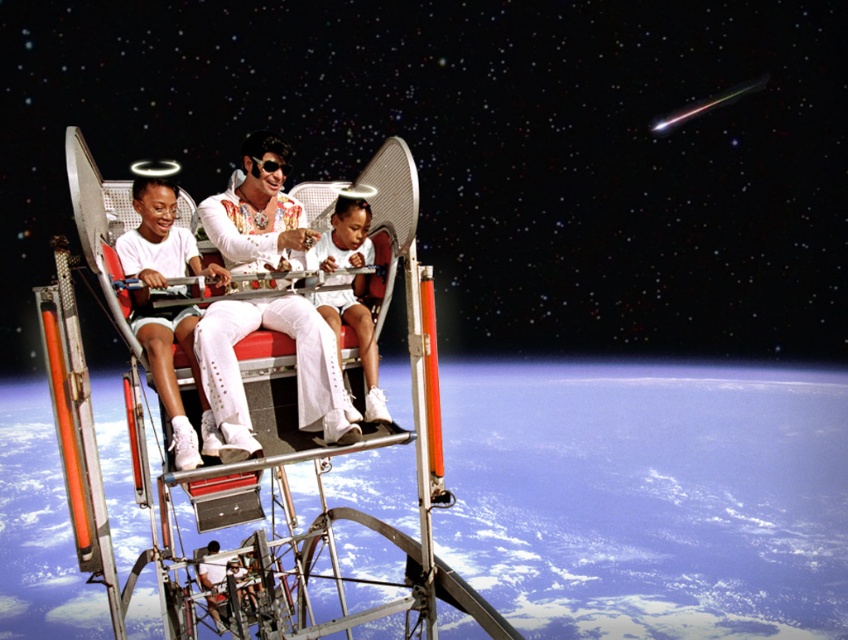
Question: Which of the following is the closest to the observer?

Choices:
 (A) white glossy shirt at center
 (B) white satin suit at center

Answer: (B)

Question: Which object is farther from the camera taking this photo?

Choices:
 (A) white satin suit at center
 (B) white glossy shirt at center
 (C) white matte shorts at left

Answer: (B)

Question: Does white satin suit at center have a smaller size compared to white glossy shirt at center?

Choices:
 (A) yes
 (B) no

Answer: (B)

Question: Can you confirm if white satin suit at center is wider than white matte shorts at left?

Choices:
 (A) yes
 (B) no

Answer: (A)

Question: Which point is closer to the camera?

Choices:
 (A) (283, 268)
 (B) (365, 243)

Answer: (A)

Question: Can you confirm if white matte shorts at left is wider than white glossy shirt at center?

Choices:
 (A) no
 (B) yes

Answer: (B)